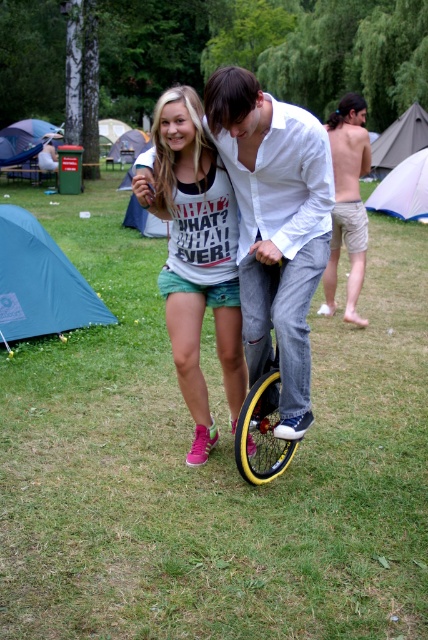
Question: Does white cotton shirt at center appear over matte white t-shirt at center?

Choices:
 (A) no
 (B) yes

Answer: (A)

Question: Estimate the real-world distances between objects in this image. Which object is farther from the yellow rubber monocycle at center?

Choices:
 (A) matte white t-shirt at center
 (B) blue fabric tent at lower left
 (C) white canvas tent at upper right

Answer: (C)

Question: Estimate the real-world distances between objects in this image. Which object is farther from the white canvas tent at upper right?

Choices:
 (A) blue fabric tent at upper left
 (B) gray canvas tent at upper right

Answer: (A)

Question: Which of these objects is positioned farthest from the white canvas tent at upper right?

Choices:
 (A) yellow rubber monocycle at center
 (B) gray canvas tent at upper right
 (C) tan shorts at center
 (D) blue fabric tent at lower left

Answer: (A)

Question: Is blue fabric tent at lower left wider than yellow rubber monocycle at center?

Choices:
 (A) yes
 (B) no

Answer: (A)

Question: Can you confirm if yellow rubber monocycle at center is smaller than blue tarpaulin tent at upper left?

Choices:
 (A) yes
 (B) no

Answer: (B)